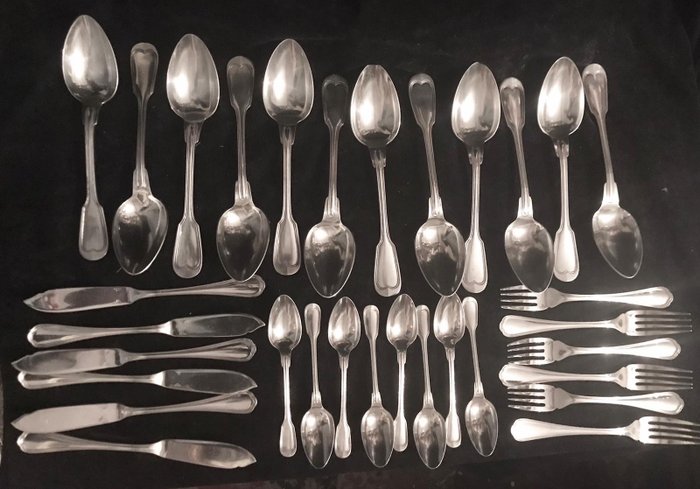
Where is `butter knife`? Image resolution: width=700 pixels, height=489 pixels. butter knife is located at coordinates (206, 450), (64, 421), (197, 380), (78, 355), (217, 326), (91, 301).